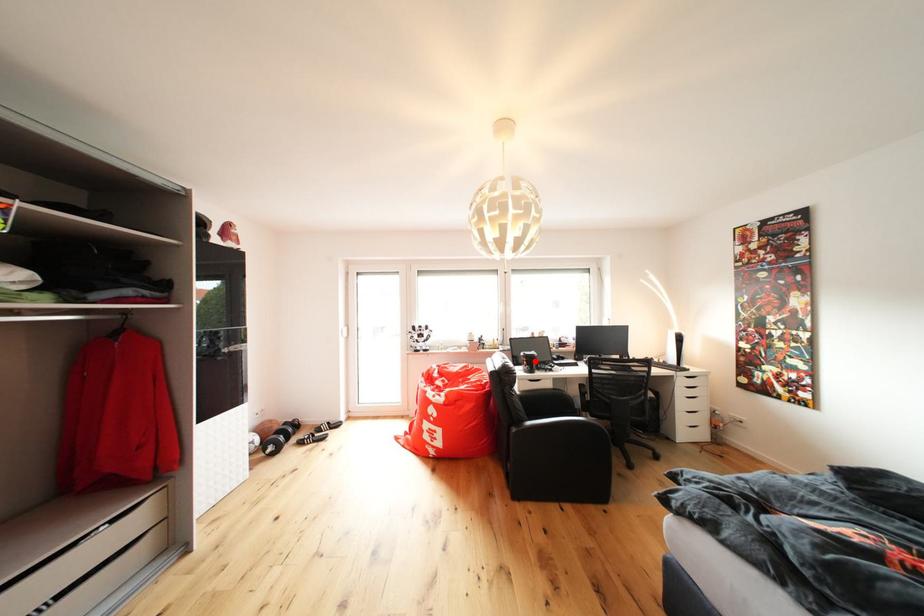
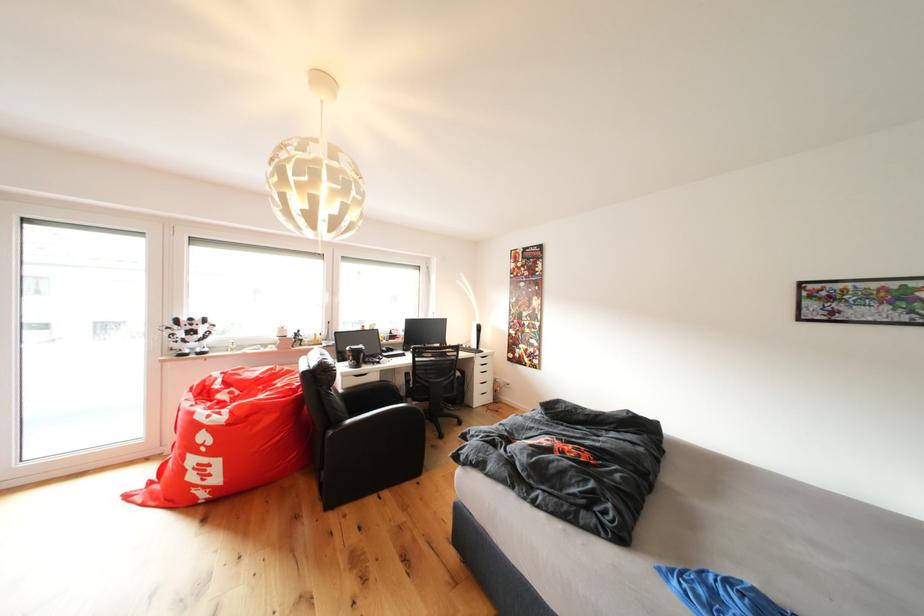
In the second image, find the point that corresponds to the highlighted location in the first image.

(361, 355)